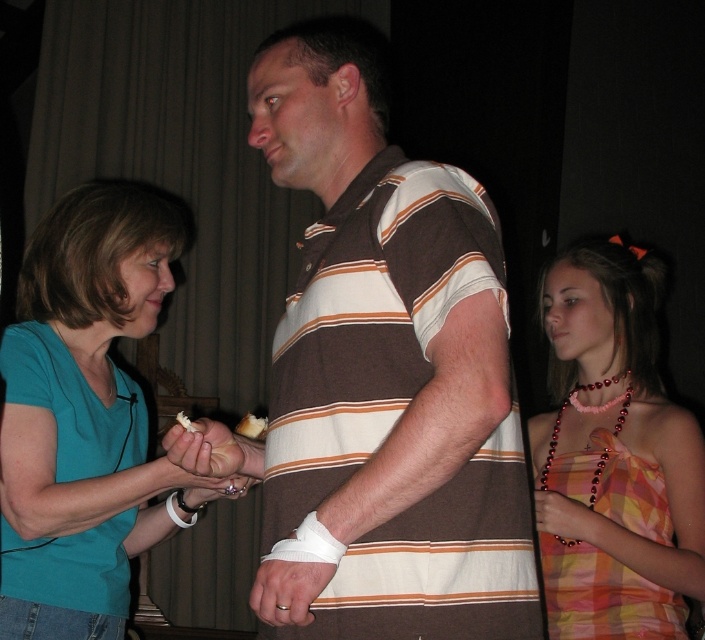
Question: Can you confirm if brown striped shirt at center is positioned above white fabric bandage at lower center?

Choices:
 (A) yes
 (B) no

Answer: (A)

Question: Is pink beaded necklace at upper right thinner than white fabric bandage at lower center?

Choices:
 (A) yes
 (B) no

Answer: (B)

Question: Which object is the farthest from the white fabric bandage at lower center?

Choices:
 (A) teal fabric shirt at left
 (B) white creamy cake at center
 (C) pink beaded necklace at upper right
 (D) brown striped shirt at center

Answer: (C)

Question: Estimate the real-world distances between objects in this image. Which object is closer to the white creamy cake at center?

Choices:
 (A) white fabric bandage at lower center
 (B) brown striped shirt at center
 (C) pink beaded necklace at upper right

Answer: (B)

Question: Is brown striped shirt at center above white fabric bandage at lower center?

Choices:
 (A) yes
 (B) no

Answer: (A)

Question: Which of the following is the closest to the observer?

Choices:
 (A) white fabric bandage at lower center
 (B) white creamy cake at center

Answer: (A)